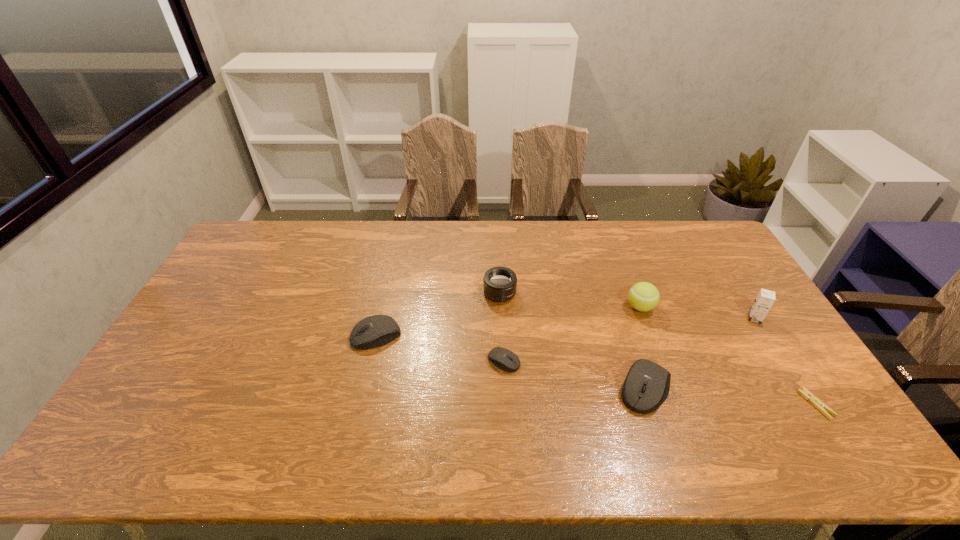
Where is `the leftmost computer equipment`? The height and width of the screenshot is (540, 960). the leftmost computer equipment is located at coordinates (374, 331).

The height and width of the screenshot is (540, 960). In order to click on the leftmost object in this screenshot , I will do click(374, 331).

What are the coordinates of `the sixth tallest object` in the screenshot? It's located at (508, 361).

At what (x,y) coordinates should I click in order to perform the action: click on the shortest computer equipment. Please return your answer as a coordinate pair (x, y). This screenshot has height=540, width=960. Looking at the image, I should click on (508, 361).

The image size is (960, 540). Find the location of `the rightmost computer equipment`. the rightmost computer equipment is located at coordinates (647, 384).

At what (x,y) coordinates should I click in order to perform the action: click on the second tallest object. Please return your answer as a coordinate pair (x, y). This screenshot has width=960, height=540. Looking at the image, I should click on pos(643,296).

The image size is (960, 540). I want to click on telephoto lens, so click(x=499, y=283).

I want to click on chocolate milk, so [x=765, y=299].

Locate an element on the screen. clothespin is located at coordinates (818, 404).

At what (x,y) coordinates should I click in order to perform the action: click on vacant region located on the back of the leftmost object. Please return your answer as a coordinate pair (x, y). The image size is (960, 540). Looking at the image, I should click on (391, 274).